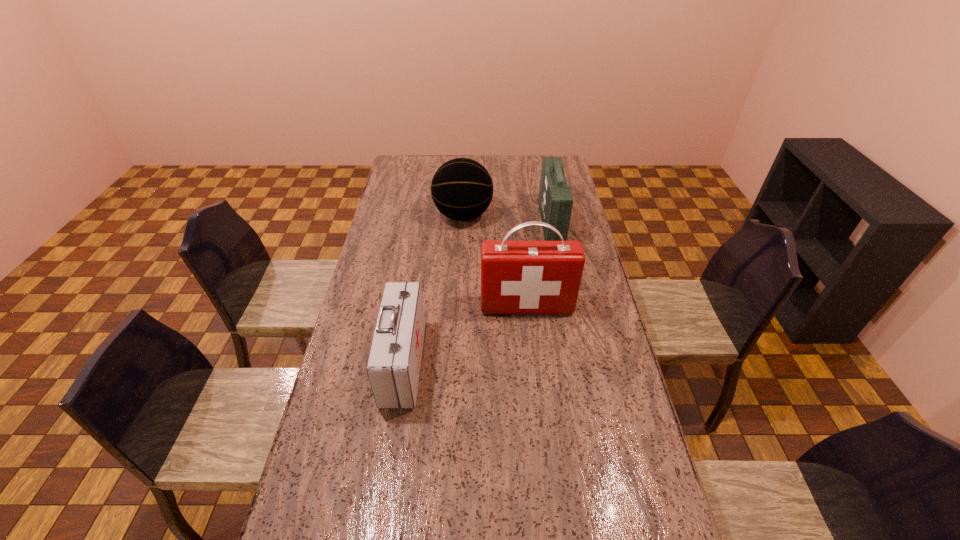
Identify the location of vacant region between the nearest first-aid kit and the basketball. This screenshot has width=960, height=540. (433, 289).

Where is `the closest object to the second shortest first-aid kit`? the closest object to the second shortest first-aid kit is located at coordinates (462, 189).

At what (x,y) coordinates should I click in order to perform the action: click on object that is the second closest one to the tallest first-aid kit. Please return your answer as a coordinate pair (x, y). This screenshot has height=540, width=960. Looking at the image, I should click on (555, 200).

Identify the location of the first-aid kit identified as the closest to the tallest object. (393, 367).

Locate an element on the screen. This screenshot has width=960, height=540. the first-aid kit that is the second nearest to the tallest first-aid kit is located at coordinates (555, 200).

In order to click on blank area in the image that satisfies the following two spatial constraints: 1. on the front face of the tallest object; 2. on the front-facing side of the shortest object in this screenshot , I will do `click(533, 363)`.

Locate an element on the screen. This screenshot has height=540, width=960. vacant space that satisfies the following two spatial constraints: 1. on the front face of the tallest object; 2. on the front-facing side of the shortest first-aid kit is located at coordinates (533, 363).

This screenshot has width=960, height=540. What are the coordinates of `vacant space that satisfies the following two spatial constraints: 1. on the front face of the second nearest first-aid kit; 2. on the front-facing side of the nearest object` in the screenshot? It's located at (533, 363).